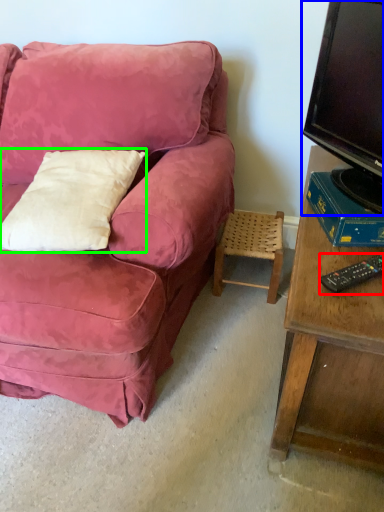
Question: Estimate the real-world distances between objects in this image. Which object is closer to remote control (highlighted by a red box), television (highlighted by a blue box) or pillow (highlighted by a green box)?

Choices:
 (A) television
 (B) pillow

Answer: (A)